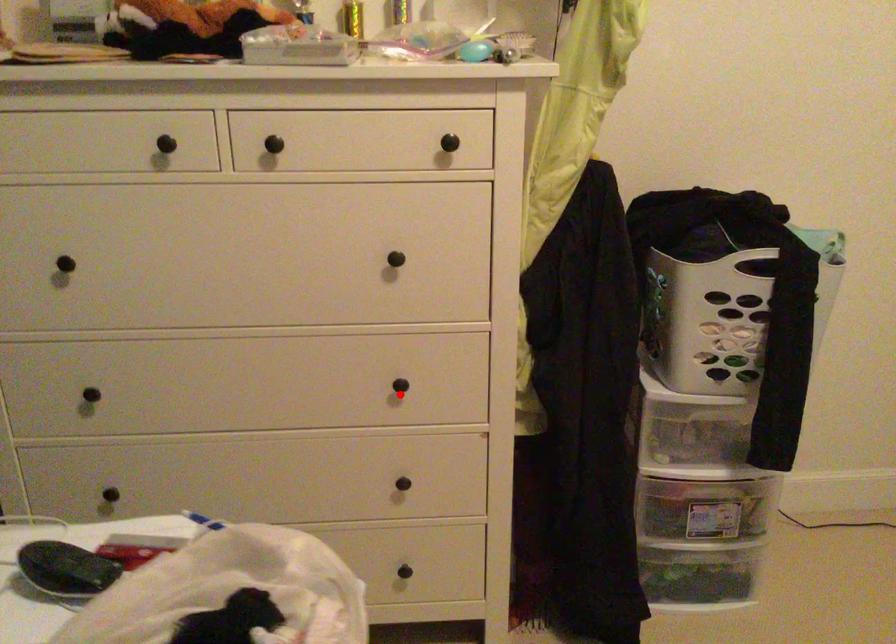
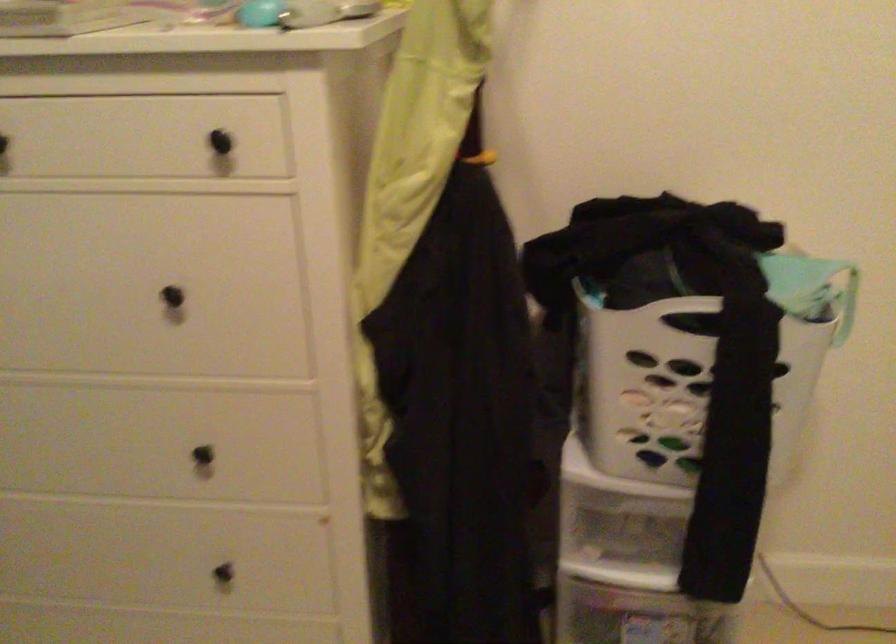
The point at the highlighted location is marked in the first image. Where is the corresponding point in the second image?

(213, 462)